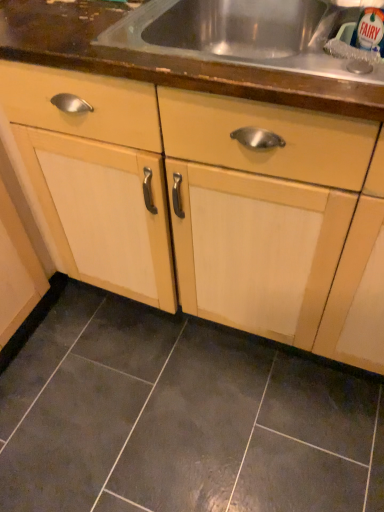
Question: Is dark gray ceramic tile at lower center to the left or to the right of wooden countertop at upper center in the image?

Choices:
 (A) right
 (B) left

Answer: (B)

Question: From the image's perspective, relative to wooden countertop at upper center, is dark gray ceramic tile at lower center above or below?

Choices:
 (A) above
 (B) below

Answer: (B)

Question: Considering the real-world distances, which object is farthest from the light wood cabinet at center?

Choices:
 (A) dark gray ceramic tile at lower center
 (B) wooden countertop at upper center

Answer: (A)

Question: Which object is positioned farthest from the light wood cabinet at center?

Choices:
 (A) wooden countertop at upper center
 (B) dark gray ceramic tile at lower center

Answer: (B)